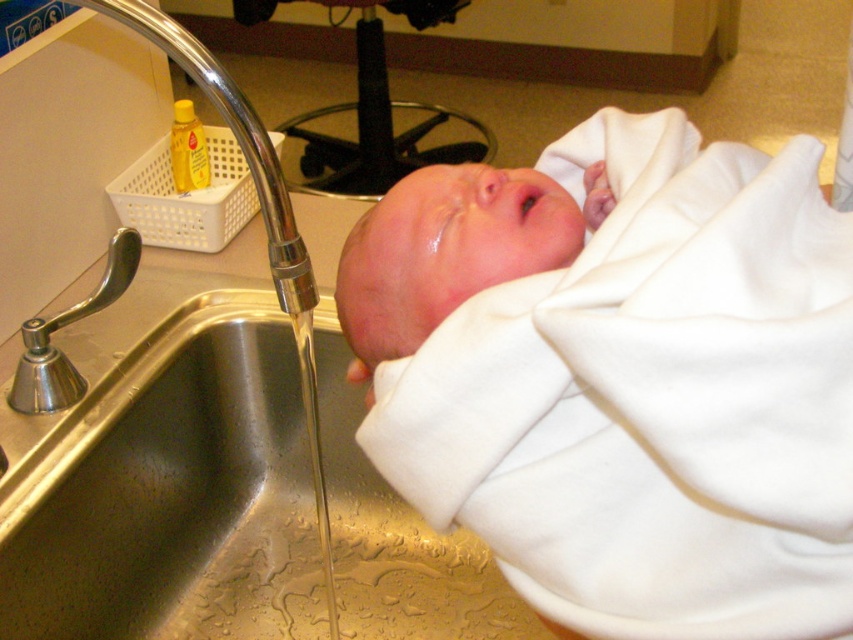
Question: Does white cotton newborn at center have a lesser width compared to stainless steel sink at center?

Choices:
 (A) yes
 (B) no

Answer: (A)

Question: Considering the real-world distances, which object is closest to the clear liquid water at sink left?

Choices:
 (A) chrome/metallic faucet at left
 (B) stainless steel sink at center

Answer: (B)

Question: Is stainless steel sink at center above chrome/metallic faucet at left?

Choices:
 (A) no
 (B) yes

Answer: (B)

Question: Which point is farther from the camera taking this photo?

Choices:
 (A) (256, 184)
 (B) (132, 237)
 (C) (370, 410)

Answer: (B)

Question: Which point is closer to the camera taking this photo?

Choices:
 (A) (321, 513)
 (B) (584, 193)
 (C) (83, 3)
 (D) (57, 365)

Answer: (C)

Question: Is white cotton newborn at center further to the viewer compared to chrome/metallic faucet at left?

Choices:
 (A) yes
 (B) no

Answer: (B)